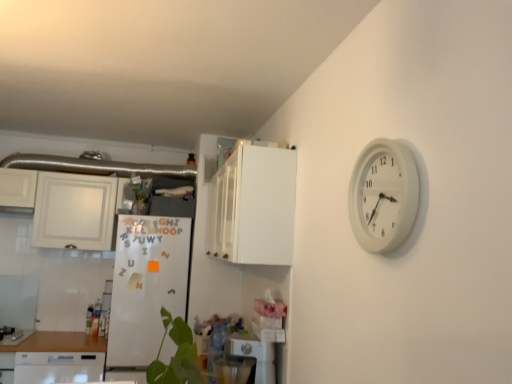
Question: Is white glossy cabinet at upper left, marked as the first cabinetry in a left-to-right arrangement, wider than white plastic dishwasher at lower center?

Choices:
 (A) yes
 (B) no

Answer: (A)

Question: Is white glossy cabinet at upper left, the 1th cabinetry when ordered from back to front, next to white plastic dishwasher at lower center?

Choices:
 (A) no
 (B) yes

Answer: (A)

Question: Is white glossy cabinet at upper left, arranged as the 2th cabinetry when viewed from the right, turned away from white plastic dishwasher at lower center?

Choices:
 (A) yes
 (B) no

Answer: (B)

Question: Is white glossy cabinet at upper left, arranged as the 2th cabinetry when viewed from the right, to the right of white plastic dishwasher at lower center from the viewer's perspective?

Choices:
 (A) no
 (B) yes

Answer: (A)

Question: Is white glossy cabinet at upper left, the 1th cabinetry when ordered from back to front, outside of white plastic dishwasher at lower center?

Choices:
 (A) no
 (B) yes

Answer: (B)

Question: Is white glossy cabinet at upper left, marked as the first cabinetry in a left-to-right arrangement, behind white plastic dishwasher at lower center?

Choices:
 (A) no
 (B) yes

Answer: (B)

Question: Does white glossy cabinet at upper left, marked as the first cabinetry in a left-to-right arrangement, have a smaller size compared to white matte refrigerator at center-left?

Choices:
 (A) no
 (B) yes

Answer: (B)

Question: From a real-world perspective, is white glossy cabinet at upper left, placed as the second cabinetry when sorted from front to back, positioned over white matte refrigerator at center-left based on gravity?

Choices:
 (A) no
 (B) yes

Answer: (B)

Question: Does white glossy cabinet at upper left, placed as the second cabinetry when sorted from front to back, appear on the right side of white matte refrigerator at center-left?

Choices:
 (A) yes
 (B) no

Answer: (B)

Question: Is white glossy cabinet at upper left, the 1th cabinetry when ordered from back to front, facing towards white matte refrigerator at center-left?

Choices:
 (A) yes
 (B) no

Answer: (B)

Question: Can you confirm if white glossy cabinet at upper left, the 1th cabinetry when ordered from back to front, is positioned to the left of white matte refrigerator at center-left?

Choices:
 (A) no
 (B) yes

Answer: (B)

Question: From the image's perspective, is white glossy cabinet at upper left, marked as the first cabinetry in a left-to-right arrangement, on white matte refrigerator at center-left?

Choices:
 (A) no
 (B) yes

Answer: (B)

Question: Is brushed metal gas stove at lower left surrounding white glossy cabinet at upper left, the 1th cabinetry when ordered from back to front?

Choices:
 (A) yes
 (B) no

Answer: (B)